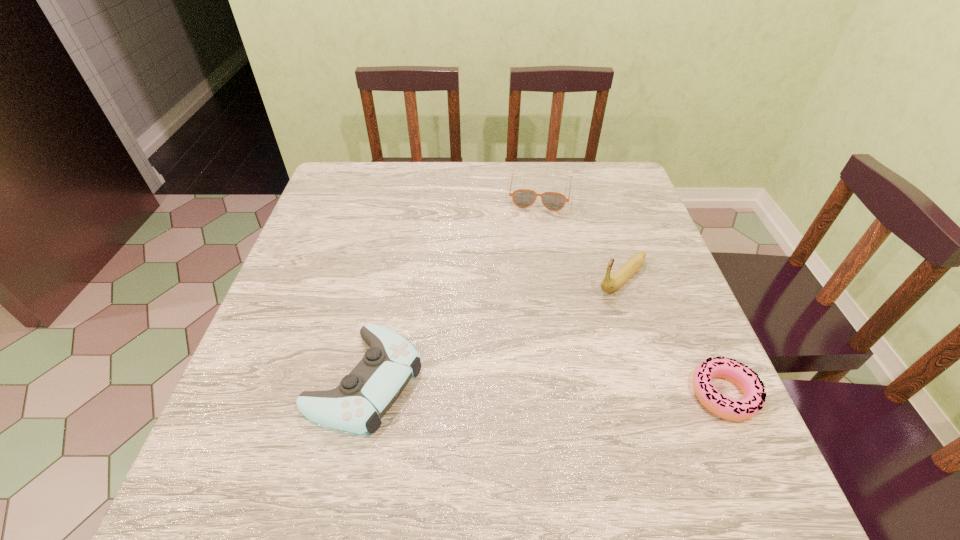
The image size is (960, 540). What are the coordinates of `vacant area between the doughnut and the banana` in the screenshot? It's located at (673, 336).

Where is `vacant area that lies between the shortest object and the leftmost object`? This screenshot has width=960, height=540. vacant area that lies between the shortest object and the leftmost object is located at coordinates (544, 387).

Where is `vacant space in between the banana and the farthest object`? This screenshot has height=540, width=960. vacant space in between the banana and the farthest object is located at coordinates (581, 235).

What are the coordinates of `vacant space that is in between the leftmost object and the doughnut` in the screenshot? It's located at (544, 387).

I want to click on blank region between the farthest object and the shortest object, so click(x=632, y=293).

Find the location of a particular element. The height and width of the screenshot is (540, 960). vacant area that lies between the tallest object and the control is located at coordinates (493, 329).

Identify which object is located as the nearest to the shortest object. Please provide its 2D coordinates. Your answer should be formatted as a tuple, i.e. [(x, y)], where the tuple contains the x and y coordinates of a point satisfying the conditions above.

[(609, 284)]

The width and height of the screenshot is (960, 540). In order to click on object that is the second closest to the control in this screenshot , I will do `click(523, 198)`.

Find the location of `vacant space that satisfies the following two spatial constraints: 1. on the back side of the third nearest object; 2. on the right side of the control`. vacant space that satisfies the following two spatial constraints: 1. on the back side of the third nearest object; 2. on the right side of the control is located at coordinates (387, 279).

Image resolution: width=960 pixels, height=540 pixels. What are the coordinates of `vacant region that satisfies the following two spatial constraints: 1. on the front side of the leftmost object; 2. on the left side of the doughnut` in the screenshot? It's located at (362, 394).